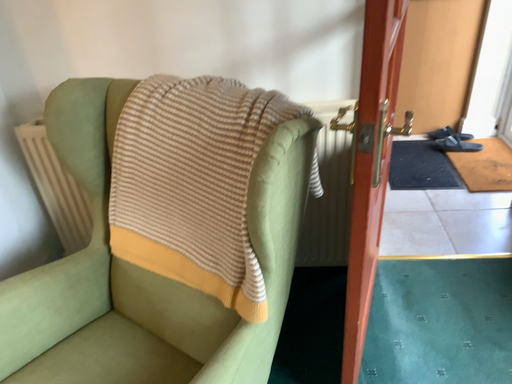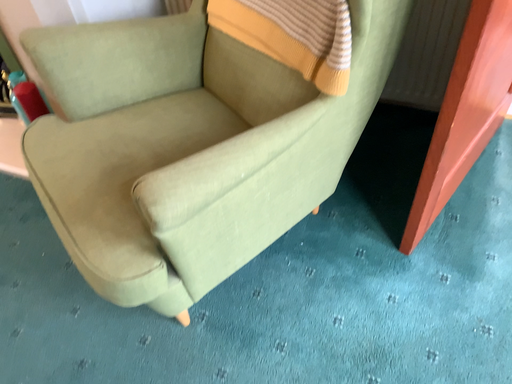
Question: How did the camera likely rotate when shooting the video?

Choices:
 (A) rotated downward
 (B) rotated upward

Answer: (A)